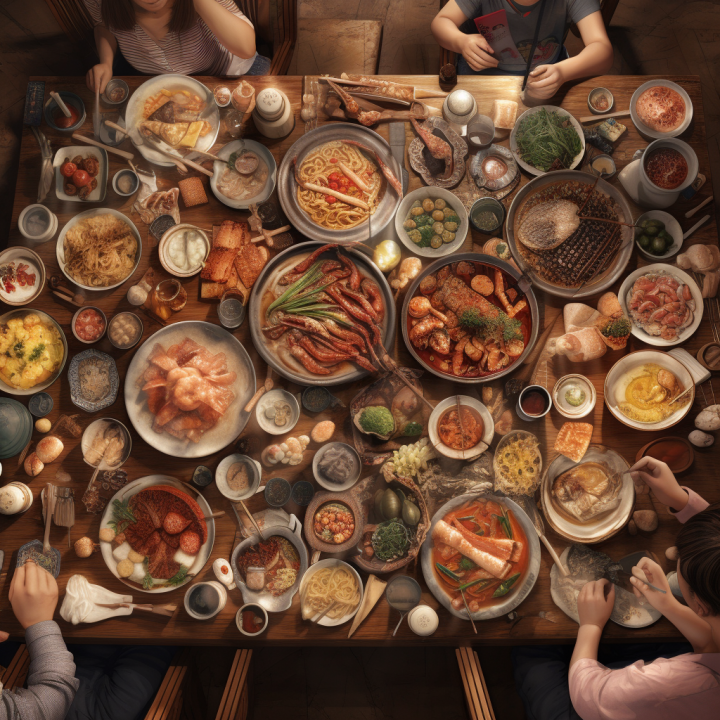
This screenshot has height=720, width=720. In order to click on rug in this screenshot , I will do `click(324, 45)`.